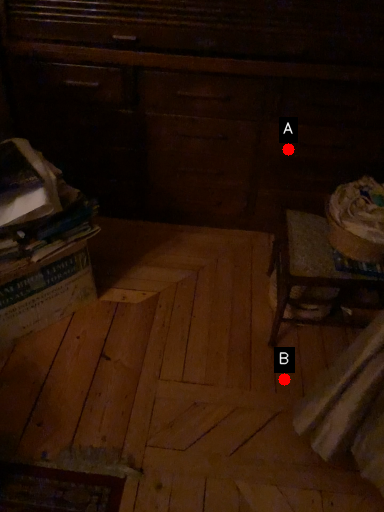
Question: Two points are circled on the image, labeled by A and B beside each circle. Which point appears closest to the camera in this image?

Choices:
 (A) A is closer
 (B) B is closer

Answer: (B)